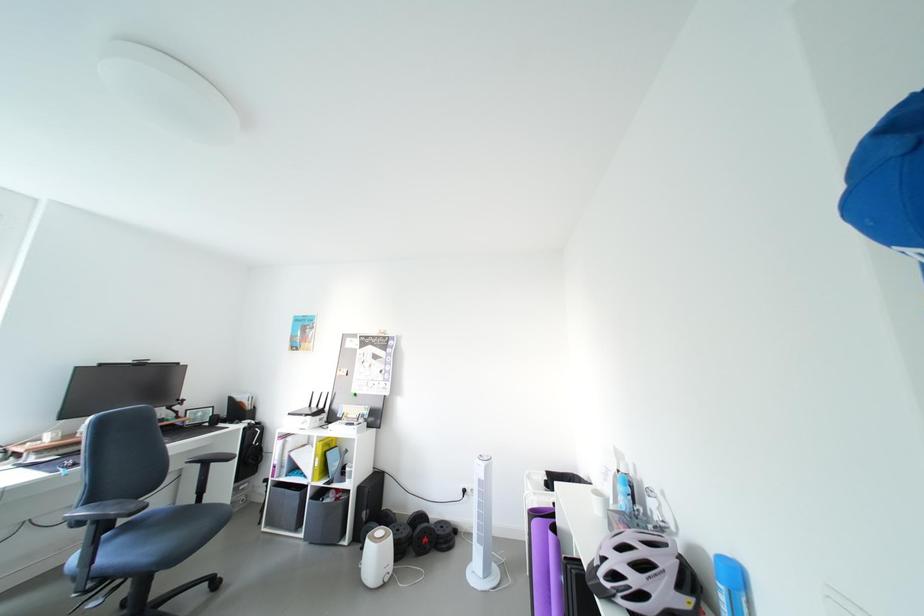
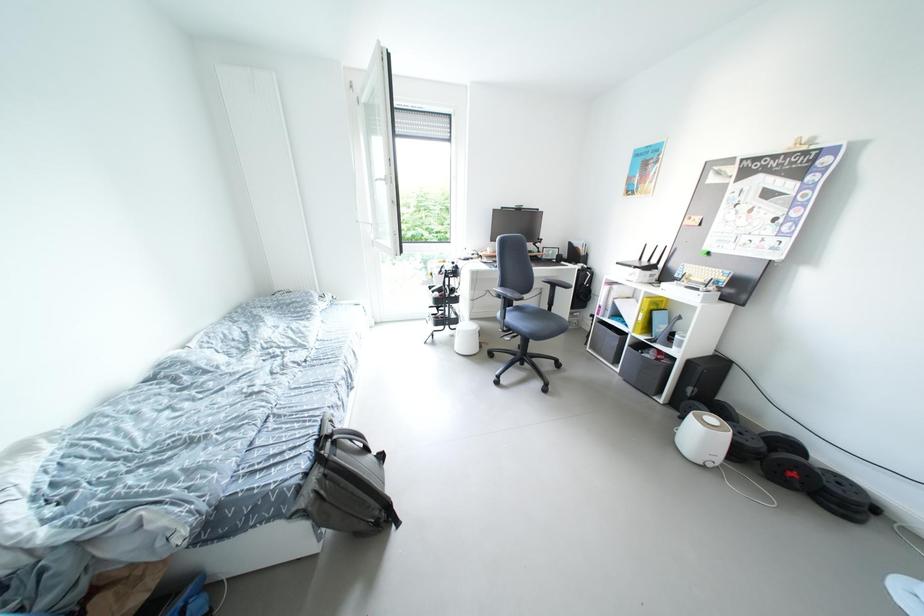
Based on the continuous images, in which direction is the camera rotating?

The rotation direction of the camera is left-down.